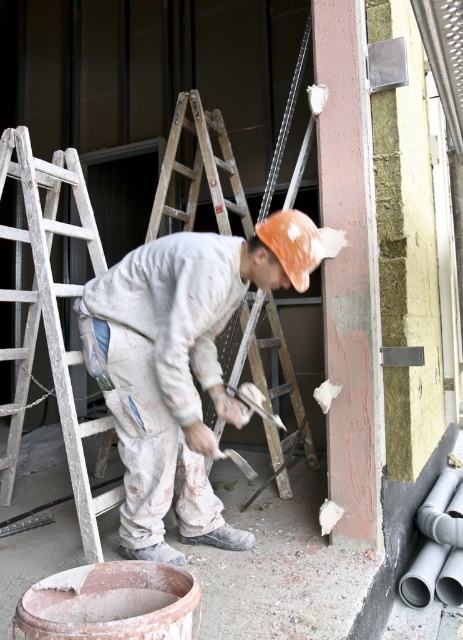
You are a construction worker who needs to reach the white matte paint at center and the wooden ladder at center. Which object is closer to your right side?

The wooden ladder at center is closer to your right side because the white matte paint at center is positioned to the left of the wooden ladder at center.

From the picture: You are a construction inspector checking the wall surface. You notice two materials on the wall surface. Which material is higher up on the wall between the white matte paint at center and the white powdery cement at lower center?

The white matte paint at center is much taller than the white powdery cement at lower center, so the white matte paint at center is higher up on the wall.